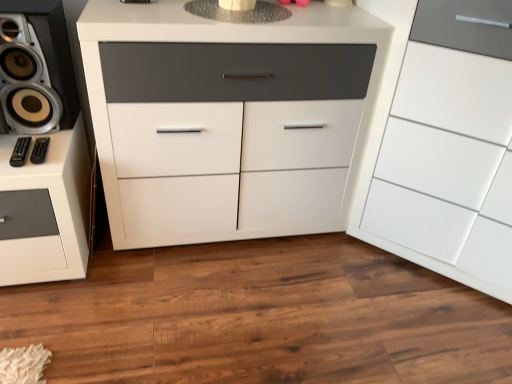
Question: From their relative heights in the image, would you say metallic silver speaker at left is taller or shorter than white matte cabinet at center, marked as the first chest of drawers in a left-to-right arrangement?

Choices:
 (A) short
 (B) tall

Answer: (A)

Question: Relative to white matte cabinet at center, the 2th chest of drawers when ordered from right to left, is metallic silver speaker at left in front or behind?

Choices:
 (A) front
 (B) behind

Answer: (B)

Question: Which of these objects is positioned closest to the black plastic remote control at lower left, which ranks as the 2th audio in left-to-right order?

Choices:
 (A) white glossy cabinet at right, the second chest of drawers when ordered from left to right
 (B) white matte cabinet at center, the 2th chest of drawers when ordered from right to left
 (C) metallic silver speaker at left
 (D) black plastic remote control at lower left, acting as the 2th audio starting from the right

Answer: (D)

Question: Which object is positioned farthest from the black plastic remote control at lower left, acting as the 2th audio starting from the right?

Choices:
 (A) white matte cabinet at center, marked as the first chest of drawers in a left-to-right arrangement
 (B) white glossy cabinet at right, positioned as the 1th chest of drawers in right-to-left order
 (C) metallic silver speaker at left
 (D) black plastic remote control at lower left, which is the first audio in right-to-left order

Answer: (B)